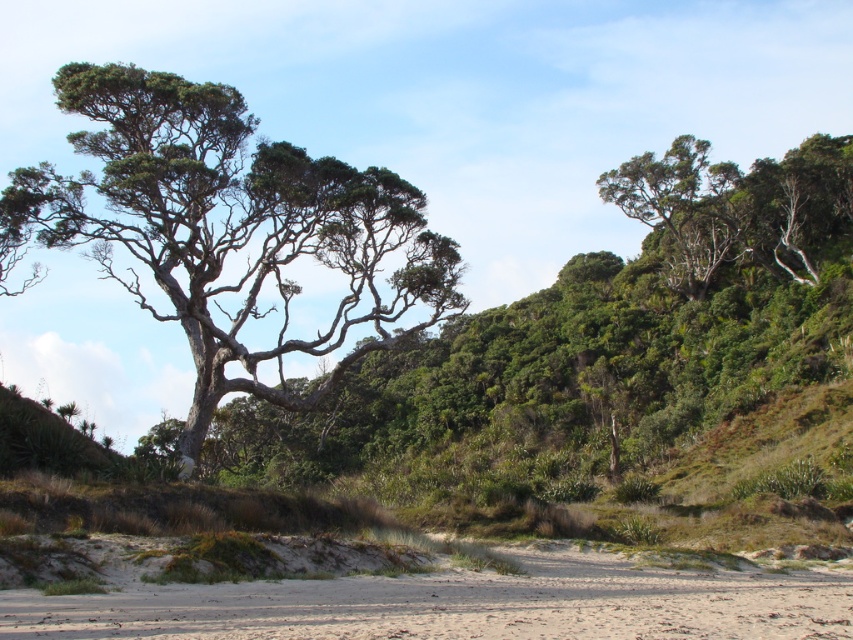
Can you confirm if light brown sandy beach at lower center is taller than green leafy tree at upper right?

No, light brown sandy beach at lower center is not taller than green leafy tree at upper right.

Between light brown sandy beach at lower center and green leafy tree at upper right, which one appears on the left side from the viewer's perspective?

Positioned to the left is light brown sandy beach at lower center.

At what (x,y) coordinates should I click in order to perform the action: click on light brown sandy beach at lower center. Please return your answer as a coordinate pair (x, y). Looking at the image, I should click on (463, 604).

Can you confirm if smooth gray bark tree at center is positioned to the right of green leafy tree at upper right?

Incorrect, smooth gray bark tree at center is not on the right side of green leafy tree at upper right.

This screenshot has height=640, width=853. Describe the element at coordinates (231, 230) in the screenshot. I see `smooth gray bark tree at center` at that location.

Who is more distant from viewer, (350, 260) or (828, 220)?

Point (828, 220)

Identify the location of smooth gray bark tree at center. (231, 230).

Between smooth gray bark tree at center and light brown sandy beach at lower center, which one has less height?

light brown sandy beach at lower center is shorter.

Does point (222, 120) come closer to viewer compared to point (759, 596)?

No, (222, 120) is behind (759, 596).

Where is `smooth gray bark tree at center`? This screenshot has width=853, height=640. smooth gray bark tree at center is located at coordinates (x=231, y=230).